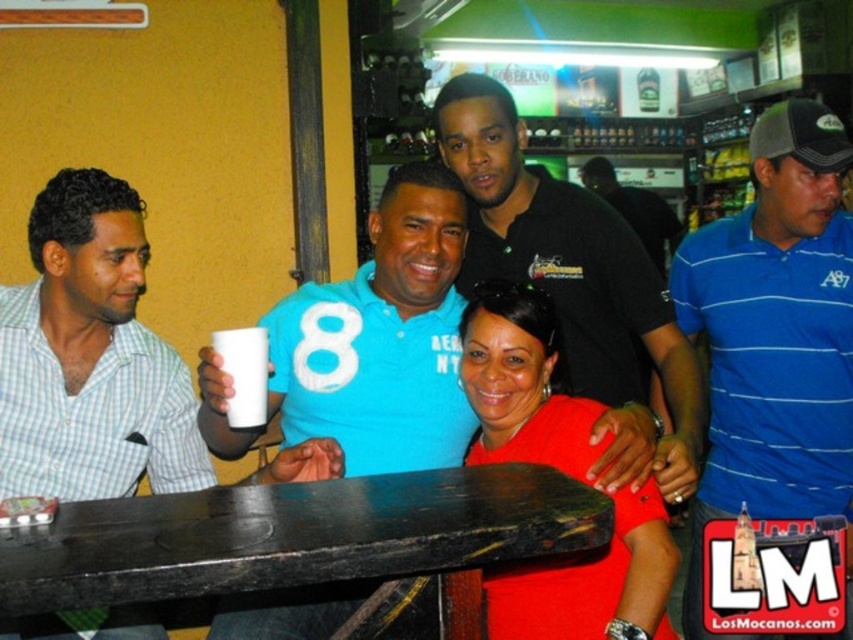
You are standing at the entrance of the bar and see the black shirt at center and the white fabric number at center. Which one is positioned to the right?

The black shirt at center is positioned to the right of the white fabric number at center.

You are a waiter at the bar and need to place a new drink order on the table. The coordinates given by the customer are point (302, 538). Where should you place the drink relative to the black matte table at center?

The point (302, 538) is on the black matte table at center, so you should place the drink directly on the black matte table at center.